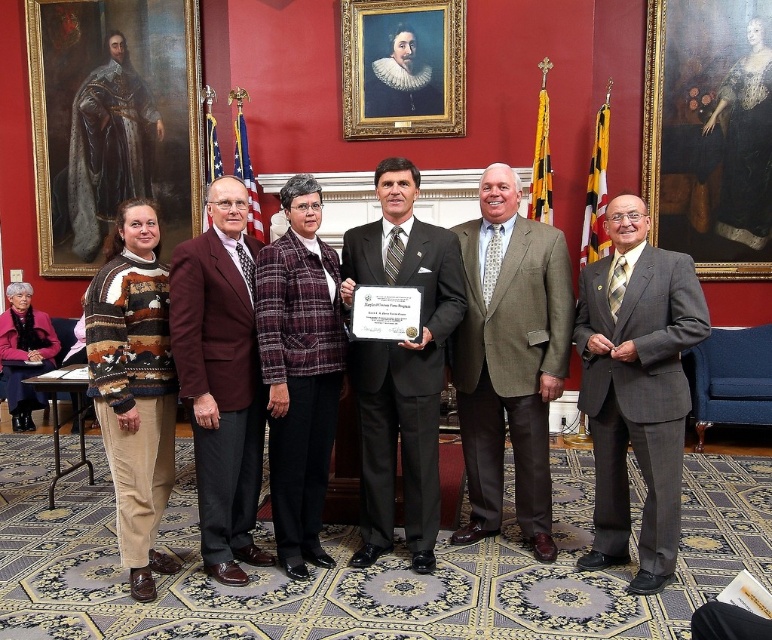
Can you confirm if gray suit at center is positioned to the right of goldwooden frame at upper center?

Indeed, gray suit at center is positioned on the right side of goldwooden frame at upper center.

Which is behind, point (631, 580) or point (442, 104)?

Positioned behind is point (442, 104).

Who is more distant from viewer, [581,292] or [435,104]?

Point [435,104]

In order to click on gray suit at center in this screenshot , I will do `click(635, 387)`.

Can you confirm if oil painting portrait at upper left is positioned below gray suit at center?

Incorrect, oil painting portrait at upper left is not positioned below gray suit at center.

Does oil painting portrait at upper left come in front of gray suit at center?

No, it is behind gray suit at center.

Who is more forward, (124, 76) or (588, 352)?

Point (588, 352) is more forward.

At what (x,y) coordinates should I click in order to perform the action: click on oil painting portrait at upper left. Please return your answer as a coordinate pair (x, y). Looking at the image, I should click on (110, 120).

Can you confirm if oil painting portrait at upper left is taller than brown wool suit at center?

Correct, oil painting portrait at upper left is much taller as brown wool suit at center.

Is oil painting portrait at upper left shorter than brown wool suit at center?

In fact, oil painting portrait at upper left may be taller than brown wool suit at center.

Between point (173, 176) and point (471, 497), which one is positioned in front?

Positioned in front is point (471, 497).

You are a GUI agent. You are given a task and a screenshot of the screen. Output one action in this format:
    pyautogui.click(x=<x>, y=<y>)
    Task: Click on the oil painting portrait at upper left
    
    Given the screenshot: What is the action you would take?
    pyautogui.click(x=110, y=120)